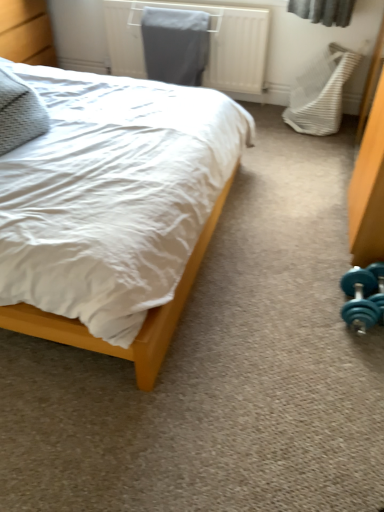
You are a GUI agent. You are given a task and a screenshot of the screen. Output one action in this format:
    pyautogui.click(x=<x>, y=<y>)
    Task: Click on the free location in front of white textured swivel chair at right
    The image size is (384, 512).
    Given the screenshot: What is the action you would take?
    pyautogui.click(x=312, y=148)